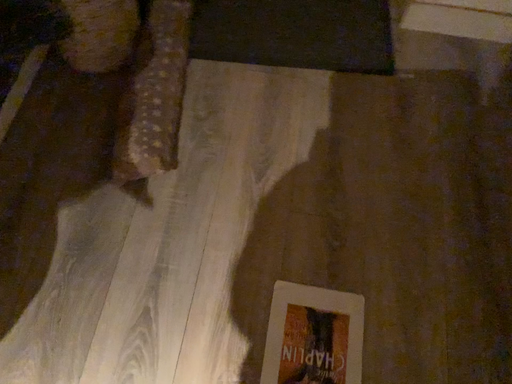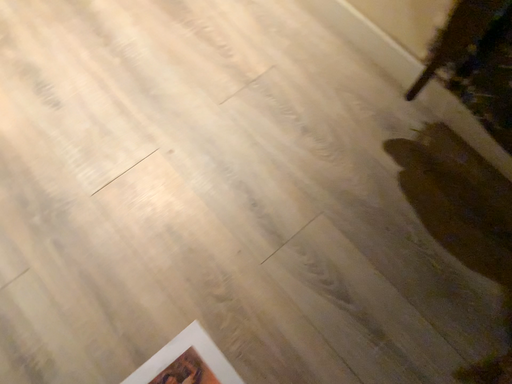
Question: How did the camera likely rotate when shooting the video?

Choices:
 (A) rotated upward
 (B) rotated downward

Answer: (A)